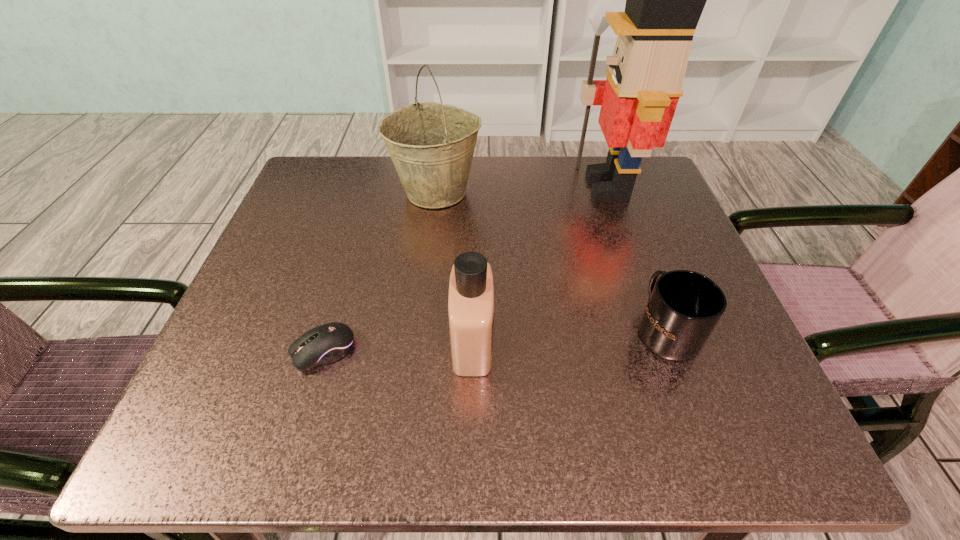
Identify the location of vacant space positioned 0.110m with the handle on the side of the mug. (639, 256).

Where is `free region located with the handle on the side of the mug`? The image size is (960, 540). free region located with the handle on the side of the mug is located at coordinates (621, 208).

At what (x,y) coordinates should I click in order to perform the action: click on vacant space located with the handle on the side of the mug. Please return your answer as a coordinate pair (x, y). Looking at the image, I should click on (636, 245).

Locate an element on the screen. The image size is (960, 540). vacant space situated 0.330m on the right of the shortest object is located at coordinates (566, 350).

Image resolution: width=960 pixels, height=540 pixels. Identify the location of nutcracker that is at the far edge. (664, 0).

At what (x,y) coordinates should I click in order to perform the action: click on wine bucket present at the far edge. Please return your answer as a coordinate pair (x, y). This screenshot has width=960, height=540. Looking at the image, I should click on (431, 144).

Locate an element on the screen. The image size is (960, 540). object located at the left edge is located at coordinates (327, 343).

Identify the location of nutcracker present at the right edge. (664, 0).

I want to click on mug that is positioned at the right edge, so click(x=683, y=308).

In order to click on object located at the far right corner in this screenshot , I will do `click(664, 0)`.